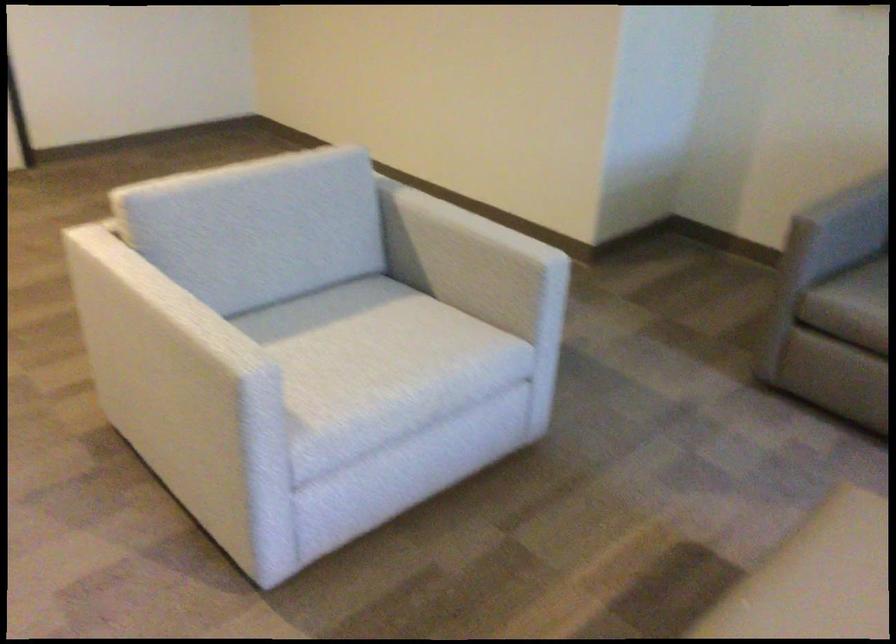
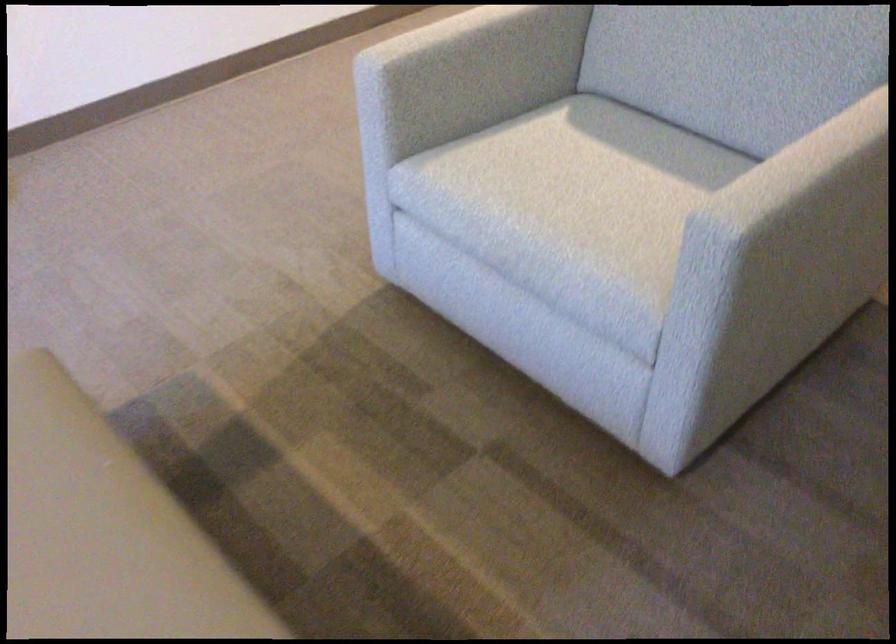
The point at [495,230] is marked in the first image. Where is the corresponding point in the second image?

(780, 178)